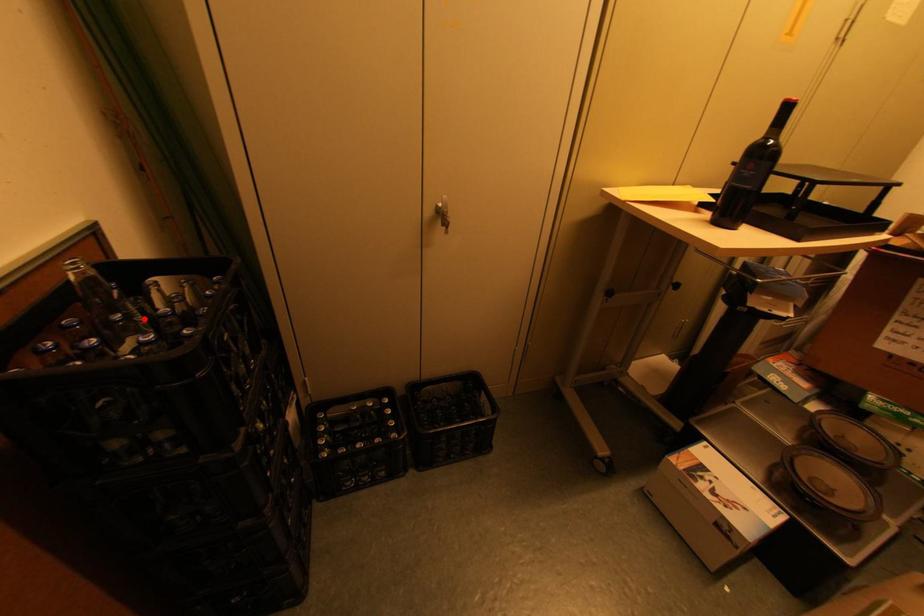
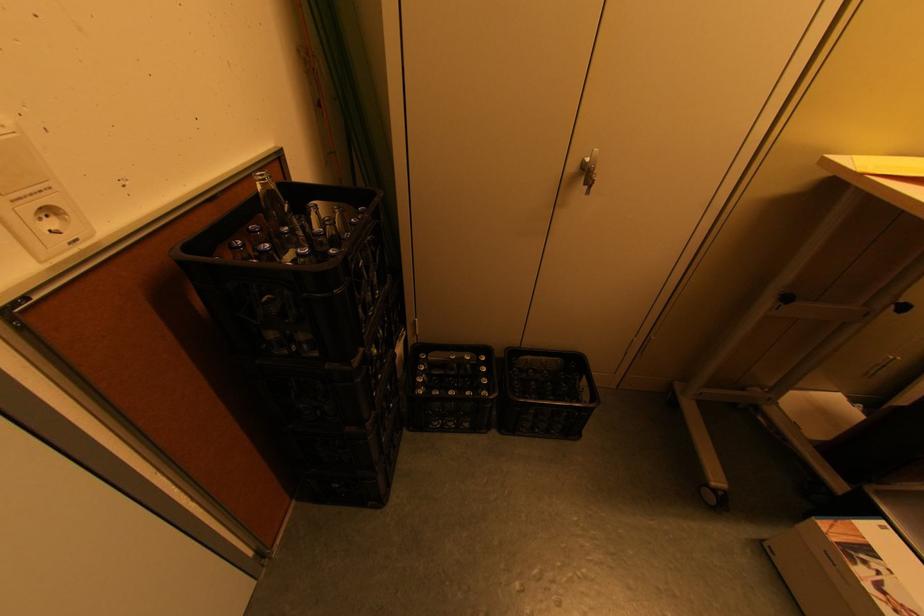
Where in the second image is the point corresponding to the highlighted location from the first image?

(304, 233)